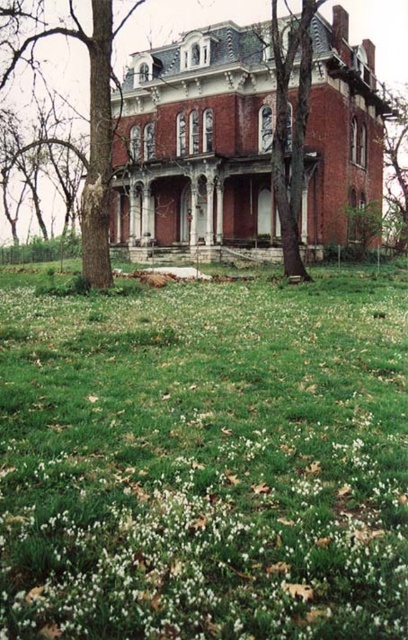
You are standing on the lawn of the historic mansion and want to walk towards the smooth bark tree at upper right. Which direction should you head from the green grass at center?

The green grass at center is to the left of the smooth bark tree at upper right, so you should head to the right to reach the smooth bark tree at upper right.

You are a visitor approaching the historic red brick mansion and notice the smooth bark tree at upper right and the stone steps at center. Which object would you see first as you walk towards the mansion from the lawn?

The smooth bark tree at upper right would be seen first because it is taller than the stone steps at center, making it more visible from a distance.